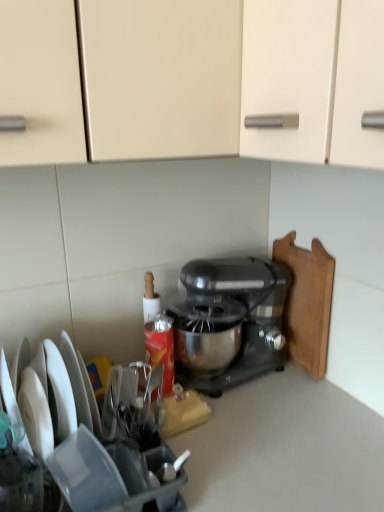
Question: Is the position of metallic silver mixer at center more distant than that of wooden cutting board at right?

Choices:
 (A) yes
 (B) no

Answer: (B)

Question: Is metallic silver mixer at center to the left of wooden cutting board at right from the viewer's perspective?

Choices:
 (A) yes
 (B) no

Answer: (A)

Question: From a real-world perspective, does metallic silver mixer at center stand above wooden cutting board at right?

Choices:
 (A) no
 (B) yes

Answer: (A)

Question: Is metallic silver mixer at center bigger than wooden cutting board at right?

Choices:
 (A) yes
 (B) no

Answer: (A)

Question: Is metallic silver mixer at center facing away from wooden cutting board at right?

Choices:
 (A) no
 (B) yes

Answer: (B)

Question: Based on their sizes in the image, would you say satin black mixer at center is bigger or smaller than wooden cutting board at right?

Choices:
 (A) small
 (B) big

Answer: (B)

Question: Is satin black mixer at center wider or thinner than wooden cutting board at right?

Choices:
 (A) thin
 (B) wide

Answer: (B)

Question: Does point (147, 470) appear closer or farther from the camera than point (286, 234)?

Choices:
 (A) closer
 (B) farther

Answer: (A)

Question: In terms of height, does satin black mixer at center look taller or shorter compared to wooden cutting board at right?

Choices:
 (A) tall
 (B) short

Answer: (B)

Question: Considering the positions of satin black mixer at center and metallic silver mixer at center in the image, is satin black mixer at center taller or shorter than metallic silver mixer at center?

Choices:
 (A) tall
 (B) short

Answer: (B)

Question: Based on their sizes in the image, would you say satin black mixer at center is bigger or smaller than metallic silver mixer at center?

Choices:
 (A) small
 (B) big

Answer: (A)

Question: Is satin black mixer at center wider or thinner than metallic silver mixer at center?

Choices:
 (A) thin
 (B) wide

Answer: (B)

Question: Which is correct: satin black mixer at center is inside metallic silver mixer at center, or outside of it?

Choices:
 (A) inside
 (B) outside

Answer: (B)

Question: Considering the positions of point (248, 281) and point (62, 354), is point (248, 281) closer or farther from the camera than point (62, 354)?

Choices:
 (A) farther
 (B) closer

Answer: (A)

Question: Considering the positions of metallic silver mixer at center and satin black mixer at center in the image, is metallic silver mixer at center wider or thinner than satin black mixer at center?

Choices:
 (A) wide
 (B) thin

Answer: (B)